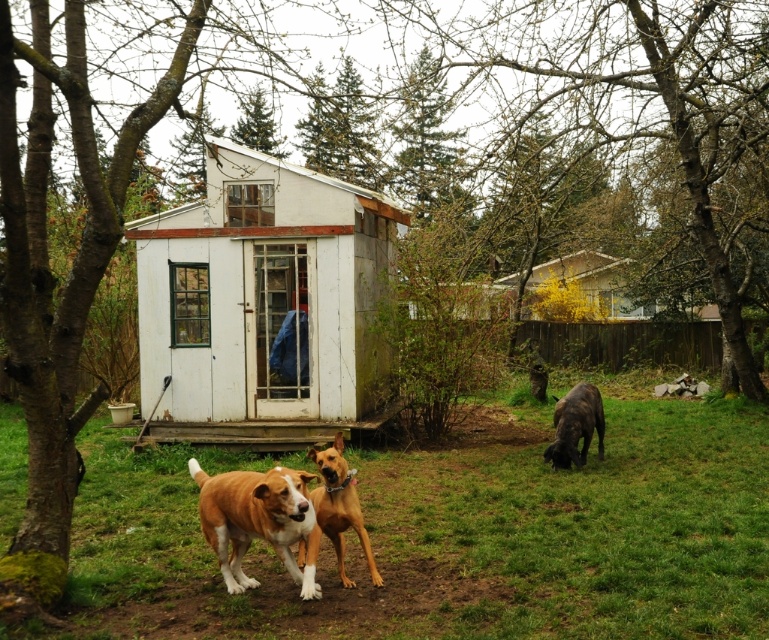
Between white wood shed at center and brown smooth dog at center, which one has more height?

white wood shed at center

At what (x,y) coordinates should I click in order to perform the action: click on white wood shed at center. Please return your answer as a coordinate pair (x, y). Looking at the image, I should click on (261, 305).

I want to click on white wood shed at center, so click(261, 305).

Who is lower down, yellow wood house at upper center or brown smooth dog at center?

brown smooth dog at center is lower down.

Who is positioned more to the right, yellow wood house at upper center or brown smooth dog at center?

yellow wood house at upper center

Is point (581, 266) positioned after point (338, 522)?

Yes, point (581, 266) is farther from viewer.

Locate an element on the screen. This screenshot has width=769, height=640. yellow wood house at upper center is located at coordinates (578, 289).

Does green grass at center have a smaller size compared to brown smooth dog at center?

Incorrect, green grass at center is not smaller in size than brown smooth dog at center.

Is point (644, 432) farther from viewer compared to point (303, 547)?

Yes, it is behind point (303, 547).

Identify the location of green grass at center. The height and width of the screenshot is (640, 769). (455, 536).